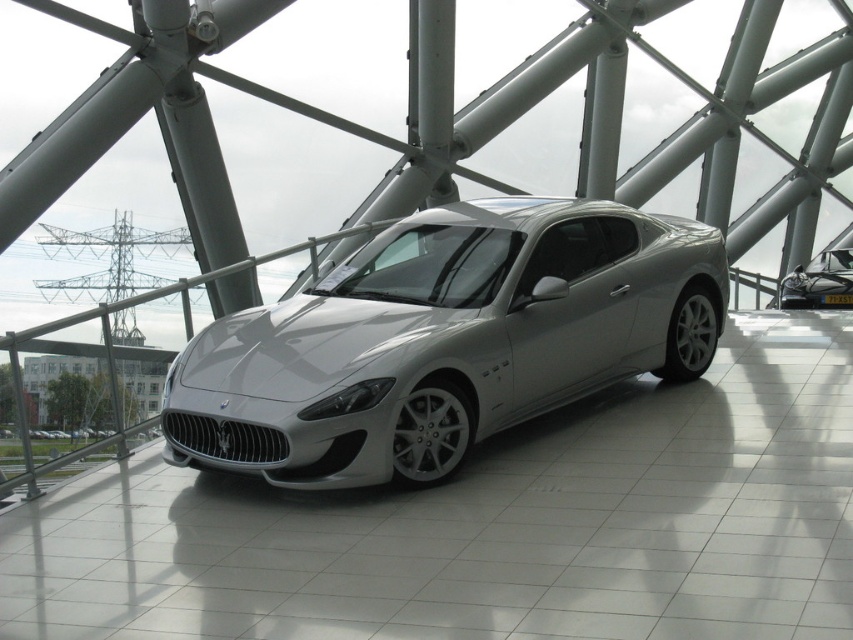
Consider the image. You are a photographer planning to take a photo of the two cars in the showroom. Since you want to highlight the sleek silver car at center and the satin silver car at center, where should you position yourself to ensure both are fully visible in the frame?

You should position yourself to the right side of the satin silver car at center so that both the sleek silver car at center on the left and the satin silver car at center on the right are fully visible in the frame.

You are a visitor at a car exhibition and see two cars, the sleek silver car at center and the satin silver car at center. Which one is positioned lower in the image?

The sleek silver car at center is located below the satin silver car at center, so it is positioned lower in the image.